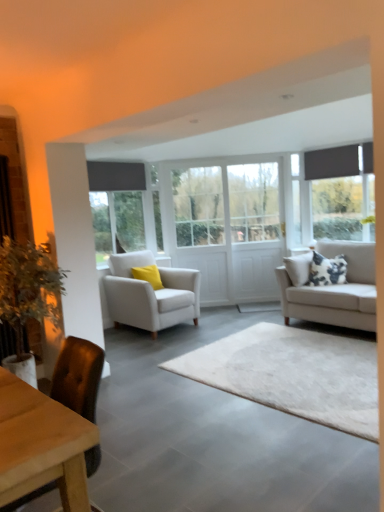
Question: Considering the positions of white wooden door at center, acting as the 2th window starting from the left, and light gray fabric couch at right in the image, is white wooden door at center, acting as the 2th window starting from the left, bigger or smaller than light gray fabric couch at right?

Choices:
 (A) big
 (B) small

Answer: (B)

Question: Looking at their shapes, would you say white wooden door at center, acting as the 2th window starting from the left, is wider or thinner than light gray fabric couch at right?

Choices:
 (A) wide
 (B) thin

Answer: (B)

Question: Estimate the real-world distances between objects in this image. Which object is closer to the white wooden door at center, placed as the 1th window when sorted from right to left?

Choices:
 (A) brown leather chair at lower left, the 1th chair when ordered from front to back
 (B) white glass door at center, the second glass door positioned from the left
 (C) white soft rug at center
 (D) matte gray window at center, which ranks as the second window in right-to-left order
 (E) white fabric armchair at center, the 2th chair from the front

Answer: (B)

Question: Estimate the real-world distances between objects in this image. Which object is closer to the matte gray window at center, the 1th window when ordered from left to right?

Choices:
 (A) white wooden door at center, placed as the 1th window when sorted from right to left
 (B) white glass door at center, the second glass door positioned from the left
 (C) white soft rug at center
 (D) clear glass door at center, placed as the second glass door when sorted from right to left
 (E) white fabric armchair at center, which ranks as the first chair in back-to-front order

Answer: (D)